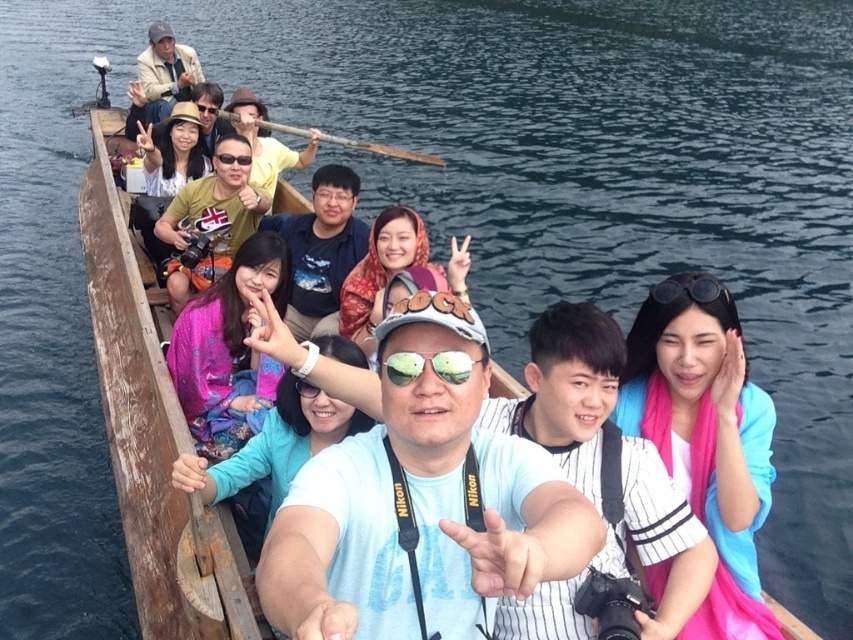
Is matte pink scarf at center wider than reflective plastic goggles at center?

Yes, matte pink scarf at center is wider than reflective plastic goggles at center.

Is matte pink scarf at center closer to the viewer compared to reflective plastic goggles at center?

That is False.

Between point (381, 285) and point (440, 364), which one is positioned behind?

Positioned behind is point (381, 285).

This screenshot has width=853, height=640. Find the location of `matte pink scarf at center`. matte pink scarf at center is located at coordinates (393, 269).

Is matte black camera at center shorter than wooden at center?

Indeed, matte black camera at center has a lesser height compared to wooden at center.

Which is more to the left, matte black camera at center or wooden at center?

matte black camera at center is more to the left.

Which is behind, point (265, 193) or point (366, 150)?

The point (366, 150) is more distant.

This screenshot has height=640, width=853. Identify the location of matte black camera at center. (213, 209).

Can you confirm if pink fabric scarf at center is positioned to the right of reflective plastic goggles at center?

Indeed, pink fabric scarf at center is positioned on the right side of reflective plastic goggles at center.

Is pink fabric scarf at center wider than reflective plastic goggles at center?

Yes, pink fabric scarf at center is wider than reflective plastic goggles at center.

Is point (733, 316) positioned after point (412, 365)?

That is True.

You are a GUI agent. You are given a task and a screenshot of the screen. Output one action in this format:
    pyautogui.click(x=<x>, y=<y>)
    Task: Click on the pink fabric scarf at center
    The height and width of the screenshot is (640, 853).
    Given the screenshot: What is the action you would take?
    pyautogui.click(x=705, y=436)